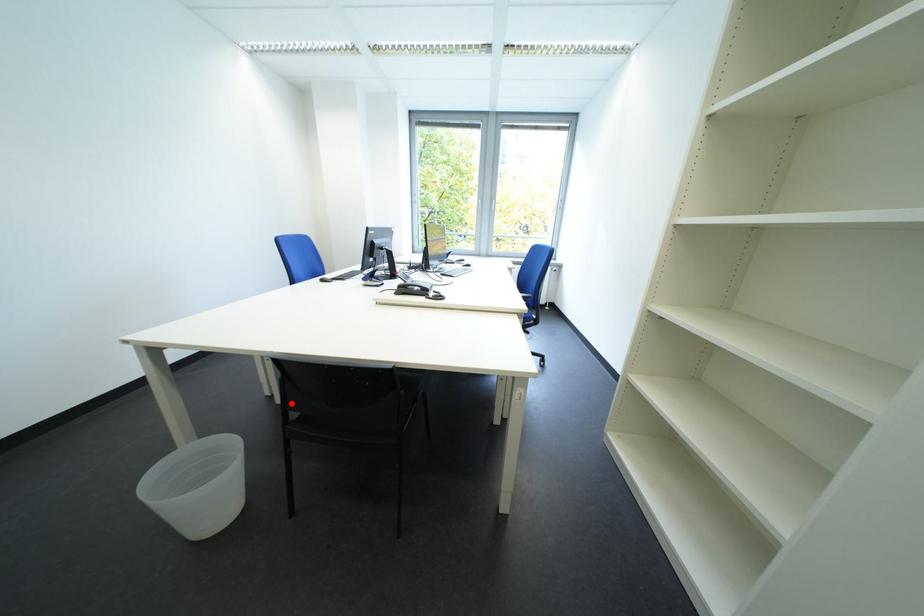
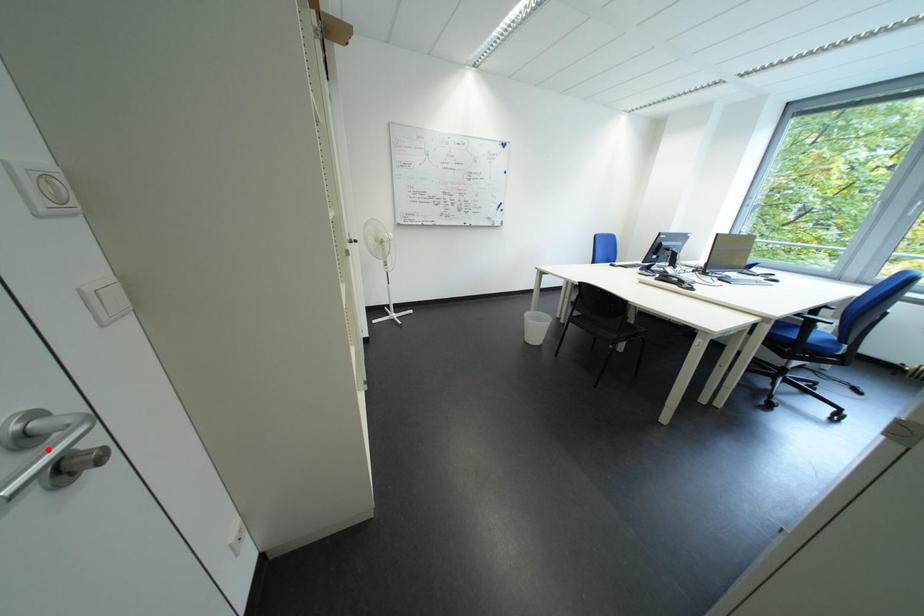
I am providing you with two images of the same scene from different viewpoints. A red point is marked on the first image and another point is marked on the second image. Do the highlighted points in image1 and image2 indicate the same real-world spot?

No